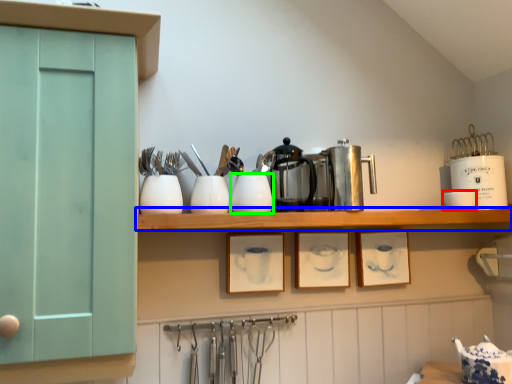
Question: Based on their relative distances, which object is farther from tableware (highlighted by a red box)? Choose from shelf (highlighted by a blue box) and tableware (highlighted by a green box).

Choices:
 (A) shelf
 (B) tableware

Answer: (B)